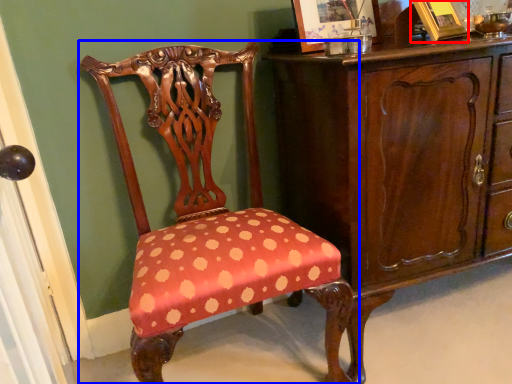
Question: Which point is further to the camera, picture frame (highlighted by a red box) or chair (highlighted by a blue box)?

Choices:
 (A) picture frame
 (B) chair

Answer: (A)